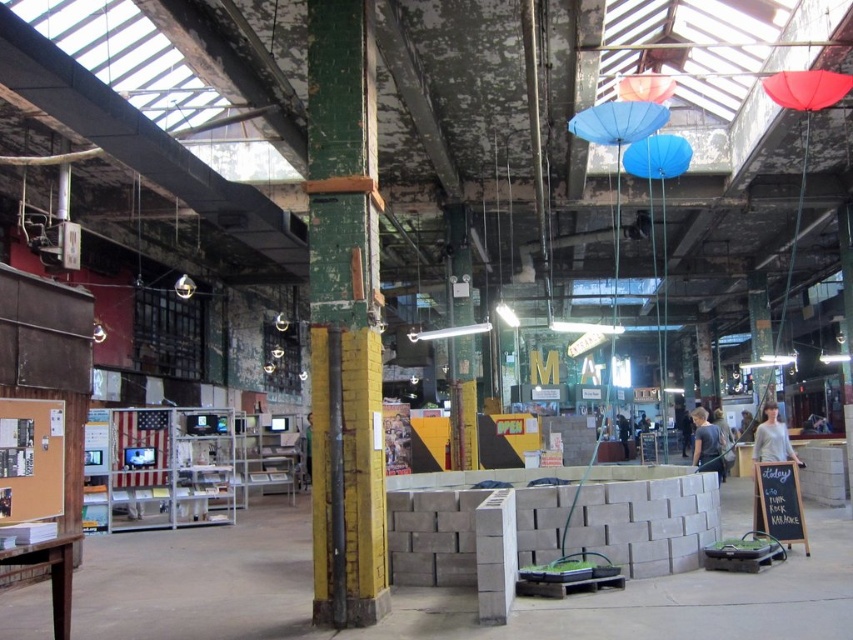
You are an interior designer assessing the space for a client who wants to place a tall plant next to the gray cotton shirt at right. Based on the scene, can the green painted wood at center support the plant without blocking the shirt?

The green painted wood at center is taller than the gray cotton shirt at right, so placing the plant there may block the view of the shirt. Consider a shorter support or a different location.